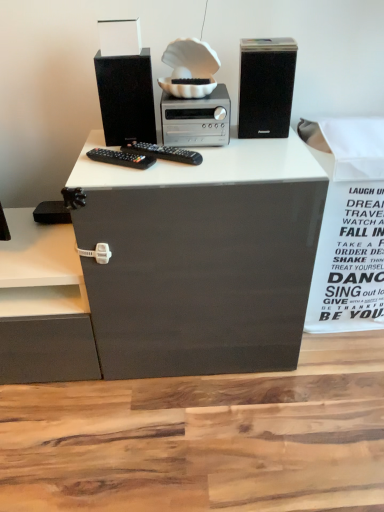
Question: Is silver metallic stereo at center in front of or behind matte black speaker at upper left, which ranks as the 1th computer tower in left-to-right order, in the image?

Choices:
 (A) front
 (B) behind

Answer: (B)

Question: In the image, is silver metallic stereo at center on the left side or the right side of matte black speaker at upper left, which ranks as the 1th computer tower in left-to-right order?

Choices:
 (A) left
 (B) right

Answer: (B)

Question: Which object is positioned closest to the black matte speaker at upper right, the 2th computer tower when ordered from left to right?

Choices:
 (A) white paper at right
 (B) matte black speaker at upper left, the second computer tower from the right
 (C) silver metallic stereo at center

Answer: (C)

Question: Based on their relative distances, which object is farther from the white paper at right?

Choices:
 (A) silver metallic stereo at center
 (B) matte black speaker at upper left, the second computer tower from the right
 (C) black matte speaker at upper right, the 2th computer tower when ordered from left to right

Answer: (B)